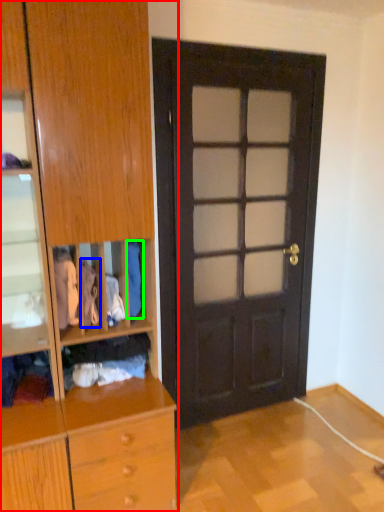
Question: Which object is positioned farthest from cabinetry (highlighted by a red box)? Select from clothing (highlighted by a blue box) and clothing (highlighted by a green box).

Choices:
 (A) clothing
 (B) clothing

Answer: (B)